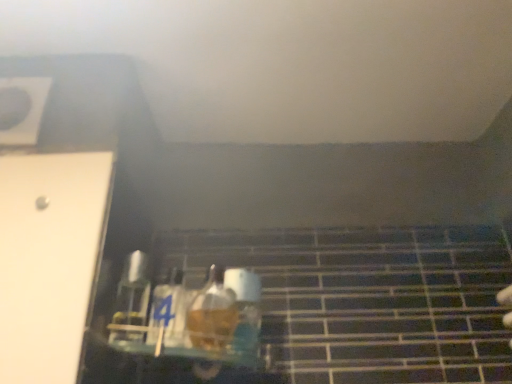
Question: Should I look upward or downward to see translucent glass bottle at center?

Choices:
 (A) up
 (B) down

Answer: (B)